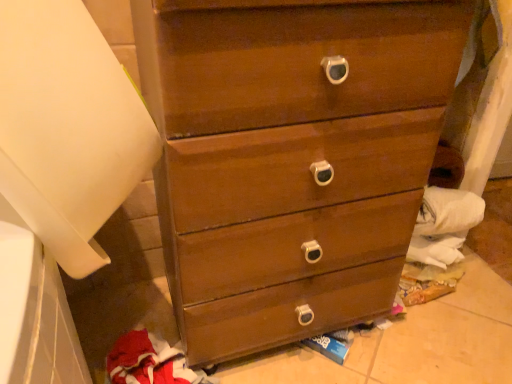
Question: Is white matte paper towel at left positioned with its back to matte wood chest of drawers at center?

Choices:
 (A) yes
 (B) no

Answer: (B)

Question: Considering the relative sizes of white matte paper towel at left and matte wood chest of drawers at center in the image provided, is white matte paper towel at left thinner than matte wood chest of drawers at center?

Choices:
 (A) yes
 (B) no

Answer: (B)

Question: Does white matte paper towel at left lie behind matte wood chest of drawers at center?

Choices:
 (A) no
 (B) yes

Answer: (A)

Question: Can you confirm if white matte paper towel at left is shorter than matte wood chest of drawers at center?

Choices:
 (A) yes
 (B) no

Answer: (A)

Question: From the image's perspective, would you say white matte paper towel at left is positioned over matte wood chest of drawers at center?

Choices:
 (A) yes
 (B) no

Answer: (A)

Question: Looking at their shapes, would you say red fleece sweatshirt at lower left is wider or thinner than matte wood chest of drawers at center?

Choices:
 (A) thin
 (B) wide

Answer: (A)

Question: From the image's perspective, is red fleece sweatshirt at lower left located above or below matte wood chest of drawers at center?

Choices:
 (A) below
 (B) above

Answer: (A)

Question: From their relative heights in the image, would you say red fleece sweatshirt at lower left is taller or shorter than matte wood chest of drawers at center?

Choices:
 (A) tall
 (B) short

Answer: (B)

Question: Considering their positions, is red fleece sweatshirt at lower left located in front of or behind matte wood chest of drawers at center?

Choices:
 (A) behind
 (B) front

Answer: (A)

Question: Is white matte paper towel at left wider or thinner than red fleece sweatshirt at lower left?

Choices:
 (A) wide
 (B) thin

Answer: (A)

Question: Choose the correct answer: Is white matte paper towel at left inside red fleece sweatshirt at lower left or outside it?

Choices:
 (A) inside
 (B) outside

Answer: (B)

Question: Is white matte paper towel at left in front of or behind red fleece sweatshirt at lower left in the image?

Choices:
 (A) front
 (B) behind

Answer: (A)

Question: In terms of height, does white matte paper towel at left look taller or shorter compared to red fleece sweatshirt at lower left?

Choices:
 (A) short
 (B) tall

Answer: (B)

Question: Considering their positions, is matte wood chest of drawers at center located in front of or behind white matte paper towel at left?

Choices:
 (A) front
 (B) behind

Answer: (B)

Question: From a real-world perspective, is matte wood chest of drawers at center physically located above or below white matte paper towel at left?

Choices:
 (A) above
 (B) below

Answer: (B)